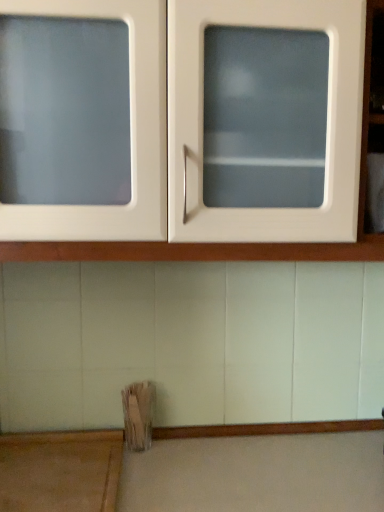
The image size is (384, 512). Describe the element at coordinates (60, 471) in the screenshot. I see `wooden at lower left` at that location.

What is the approximate height of wooden at lower left?

It is 1.64 inches.

Where is `wooden at lower left`? The image size is (384, 512). wooden at lower left is located at coordinates (60, 471).

Identify the location of white glossy cabinet at upper center. (223, 244).

This screenshot has height=512, width=384. What do you see at coordinates (223, 244) in the screenshot?
I see `white glossy cabinet at upper center` at bounding box center [223, 244].

The height and width of the screenshot is (512, 384). I want to click on wooden at lower left, so click(60, 471).

Considering the relative positions of white glossy cabinet at upper center and wooden at lower left in the image provided, is white glossy cabinet at upper center to the right of wooden at lower left from the viewer's perspective?

Correct, you'll find white glossy cabinet at upper center to the right of wooden at lower left.

Is the position of white glossy cabinet at upper center more distant than that of wooden at lower left?

No, white glossy cabinet at upper center is in front of wooden at lower left.

Is point (276, 252) positioned in front of point (49, 440)?

Yes, it is.

From the image's perspective, would you say white glossy cabinet at upper center is positioned over wooden at lower left?

Yes, from the image's perspective, white glossy cabinet at upper center is on top of wooden at lower left.

From a real-world perspective, is white glossy cabinet at upper center positioned above or below wooden at lower left?

Clearly, from a real-world perspective, white glossy cabinet at upper center is above wooden at lower left.

Considering the sizes of white glossy cabinet at upper center and wooden at lower left in the image, is white glossy cabinet at upper center wider or thinner than wooden at lower left?

In the image, white glossy cabinet at upper center appears to be wider than wooden at lower left.

Considering the sizes of objects white glossy cabinet at upper center and wooden at lower left in the image provided, who is shorter, white glossy cabinet at upper center or wooden at lower left?

Standing shorter between the two is wooden at lower left.

Does white glossy cabinet at upper center have a larger size compared to wooden at lower left?

Yes, white glossy cabinet at upper center is bigger than wooden at lower left.

Is wooden at lower left inside white glossy cabinet at upper center?

No, wooden at lower left is located outside of white glossy cabinet at upper center.

Is white glossy cabinet at upper center not near wooden at lower left?

No.

Is white glossy cabinet at upper center looking in the opposite direction of wooden at lower left?

No, white glossy cabinet at upper center is not facing away from wooden at lower left.

Looking at this image, can you tell me how much white glossy cabinet at upper center and wooden at lower left differ in facing direction?

They differ by 1.27 degrees in their facing directions.

From the picture: Measure the distance between white glossy cabinet at upper center and wooden at lower left.

A distance of 22.97 inches exists between white glossy cabinet at upper center and wooden at lower left.

Where is `cabinetry above the wooden at lower left (from the image's perspective)`? cabinetry above the wooden at lower left (from the image's perspective) is located at coordinates (223, 244).

Does wooden at lower left appear on the left side of white glossy cabinet at upper center?

Yes, wooden at lower left is to the left of white glossy cabinet at upper center.

Does wooden at lower left lie in front of white glossy cabinet at upper center?

No.

Is point (47, 503) farther from camera compared to point (286, 248)?

Yes, point (47, 503) is behind point (286, 248).

From the image's perspective, which is above, wooden at lower left or white glossy cabinet at upper center?

white glossy cabinet at upper center.

From a real-world perspective, is wooden at lower left above or below white glossy cabinet at upper center?

Clearly, from a real-world perspective, wooden at lower left is below white glossy cabinet at upper center.

Looking at their sizes, would you say wooden at lower left is wider or thinner than white glossy cabinet at upper center?

Considering their sizes, wooden at lower left looks slimmer than white glossy cabinet at upper center.

Is wooden at lower left shorter than white glossy cabinet at upper center?

Yes.

Who is smaller, wooden at lower left or white glossy cabinet at upper center?

Smaller between the two is wooden at lower left.

Does wooden at lower left contain white glossy cabinet at upper center?

No, white glossy cabinet at upper center is not a part of wooden at lower left.

Based on the photo, is wooden at lower left in contact with white glossy cabinet at upper center?

wooden at lower left and white glossy cabinet at upper center are clearly separated.

Could you tell me if wooden at lower left is turned towards white glossy cabinet at upper center?

No.

How different are the orientations of wooden at lower left and white glossy cabinet at upper center in degrees?

The angular difference between wooden at lower left and white glossy cabinet at upper center is 1.27 degrees.

Measure the distance from wooden at lower left to white glossy cabinet at upper center.

They are 22.97 inches apart.

Where is `table that appears behind the white glossy cabinet at upper center`? The width and height of the screenshot is (384, 512). table that appears behind the white glossy cabinet at upper center is located at coordinates (60, 471).

Locate an element on the screen. The width and height of the screenshot is (384, 512). table below the white glossy cabinet at upper center (from the image's perspective) is located at coordinates point(60,471).

At what (x,y) coordinates should I click in order to perform the action: click on cabinetry above the wooden at lower left (from a real-world perspective). Please return your answer as a coordinate pair (x, y). The width and height of the screenshot is (384, 512). Looking at the image, I should click on (223, 244).